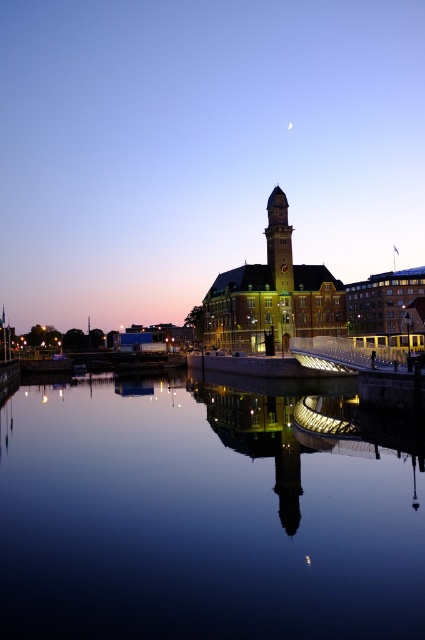
Does golden brick tower at center appear under golden stone clock tower at center?

Correct, golden brick tower at center is located below golden stone clock tower at center.

Does golden brick tower at center have a greater width compared to golden stone clock tower at center?

Yes, golden brick tower at center is wider than golden stone clock tower at center.

Where is `golden brick tower at center`? This screenshot has height=640, width=425. golden brick tower at center is located at coordinates (272, 296).

The width and height of the screenshot is (425, 640). I want to click on golden brick tower at center, so click(272, 296).

Between point (370, 484) and point (280, 212), which one is positioned in front?

Point (370, 484)

Is smooth glass water at center smaller than golden stone clock tower at center?

No.

Where is `smooth glass water at center`? smooth glass water at center is located at coordinates (200, 518).

I want to click on smooth glass water at center, so click(200, 518).

Is point (81, 576) farther from camera compared to point (295, 292)?

No, (81, 576) is in front of (295, 292).

Does point (110, 390) come in front of point (252, 346)?

That is False.

In order to click on smooth glass water at center in this screenshot , I will do `click(200, 518)`.